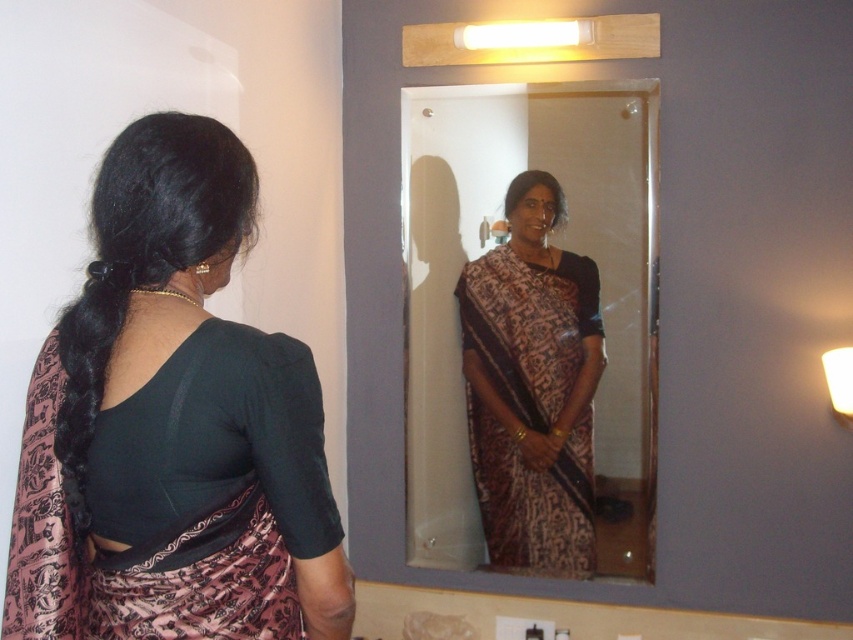
You are a painter trying to capture the scene in the image. You notice two points marked in the image. Which point is closer to you, point (85, 589) or point (491, 518)?

Point (85, 589) is closer to the viewer than point (491, 518).

You are a fashion designer observing the woman in the scene. You need to determine which item is smaller in size between the matte black blouse at center and the matte glass mirror at center. Which one is it?

The matte black blouse at center has a smaller size compared to the matte glass mirror at center, so the matte black blouse at center is smaller.

Consider the image. You are a fashion designer observing the woman in the scene. You need to suggest an adjustment to her outfit based on the position of the brown printed saree at center relative to the matte glass mirror at center. Which side of the saree should she focus on adjusting?

The matte glass mirror at center is to the left of the brown printed saree at center, so the woman should focus on adjusting the right side of the brown printed saree at center to ensure it aligns properly with her reflection in the mirror.